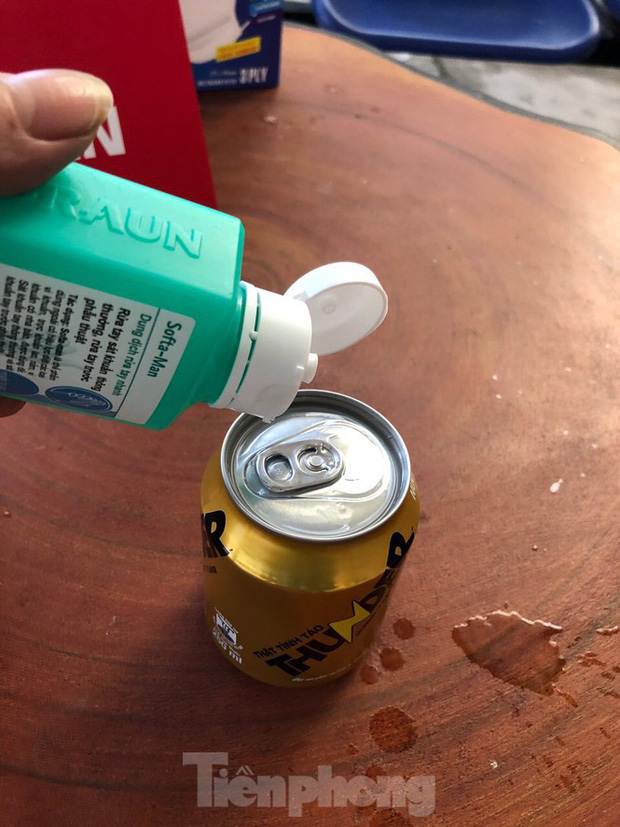
Where is `green bottle`? This screenshot has width=620, height=827. green bottle is located at coordinates (170, 265).